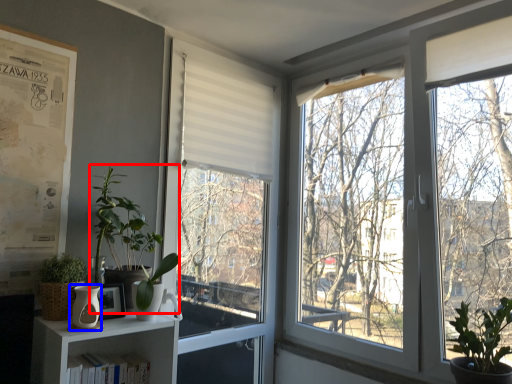
Question: Which object is further to the camera taking this photo, vegetation (highlighted by a red box) or vase (highlighted by a blue box)?

Choices:
 (A) vegetation
 (B) vase

Answer: (A)